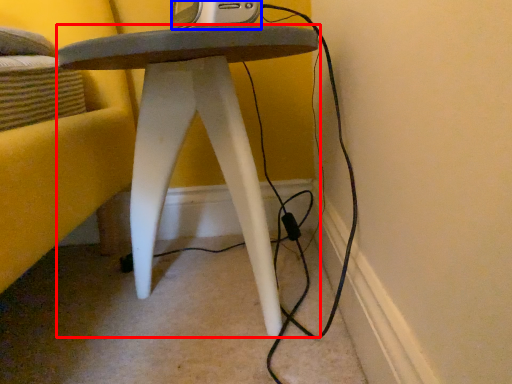
Question: Which point is further to the camera, stool (highlighted by a red box) or gadget (highlighted by a blue box)?

Choices:
 (A) stool
 (B) gadget

Answer: (B)